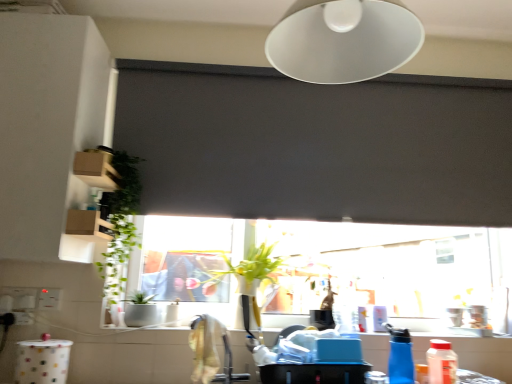
Question: Should I look upward or downward to see dark matte window screen at center?

Choices:
 (A) down
 (B) up

Answer: (B)

Question: Is white plastic electric outlet at lower left thinner than white matte lampshade at upper center?

Choices:
 (A) yes
 (B) no

Answer: (A)

Question: Is white plastic electric outlet at lower left closer to the viewer compared to white matte lampshade at upper center?

Choices:
 (A) yes
 (B) no

Answer: (B)

Question: Considering the relative sizes of white plastic electric outlet at lower left and white matte lampshade at upper center in the image provided, is white plastic electric outlet at lower left wider than white matte lampshade at upper center?

Choices:
 (A) no
 (B) yes

Answer: (A)

Question: Considering the relative sizes of white plastic electric outlet at lower left and white matte lampshade at upper center in the image provided, is white plastic electric outlet at lower left shorter than white matte lampshade at upper center?

Choices:
 (A) no
 (B) yes

Answer: (B)

Question: Considering the relative sizes of white plastic electric outlet at lower left and white matte lampshade at upper center in the image provided, is white plastic electric outlet at lower left bigger than white matte lampshade at upper center?

Choices:
 (A) no
 (B) yes

Answer: (A)

Question: From the image's perspective, is white plastic electric outlet at lower left located beneath white matte lampshade at upper center?

Choices:
 (A) yes
 (B) no

Answer: (A)

Question: Considering the relative sizes of blue plastic bottle at lower right, positioned as the second bottle in right-to-left order, and transparent glass window at center in the image provided, is blue plastic bottle at lower right, positioned as the second bottle in right-to-left order, taller than transparent glass window at center?

Choices:
 (A) yes
 (B) no

Answer: (B)

Question: From the image's perspective, would you say blue plastic bottle at lower right, arranged as the 1th bottle when viewed from the left, is positioned over transparent glass window at center?

Choices:
 (A) no
 (B) yes

Answer: (A)

Question: Is blue plastic bottle at lower right, arranged as the 1th bottle when viewed from the left, oriented away from transparent glass window at center?

Choices:
 (A) no
 (B) yes

Answer: (A)

Question: Can you confirm if blue plastic bottle at lower right, positioned as the second bottle in right-to-left order, is positioned to the left of transparent glass window at center?

Choices:
 (A) no
 (B) yes

Answer: (A)

Question: Can you see blue plastic bottle at lower right, positioned as the second bottle in right-to-left order, touching transparent glass window at center?

Choices:
 (A) no
 (B) yes

Answer: (A)

Question: Is blue plastic bottle at lower right, arranged as the 1th bottle when viewed from the left, wider than transparent glass window at center?

Choices:
 (A) yes
 (B) no

Answer: (A)

Question: Is white plastic electric outlet at lower left far from blue plastic bottle at lower right, positioned as the second bottle in right-to-left order?

Choices:
 (A) yes
 (B) no

Answer: (A)